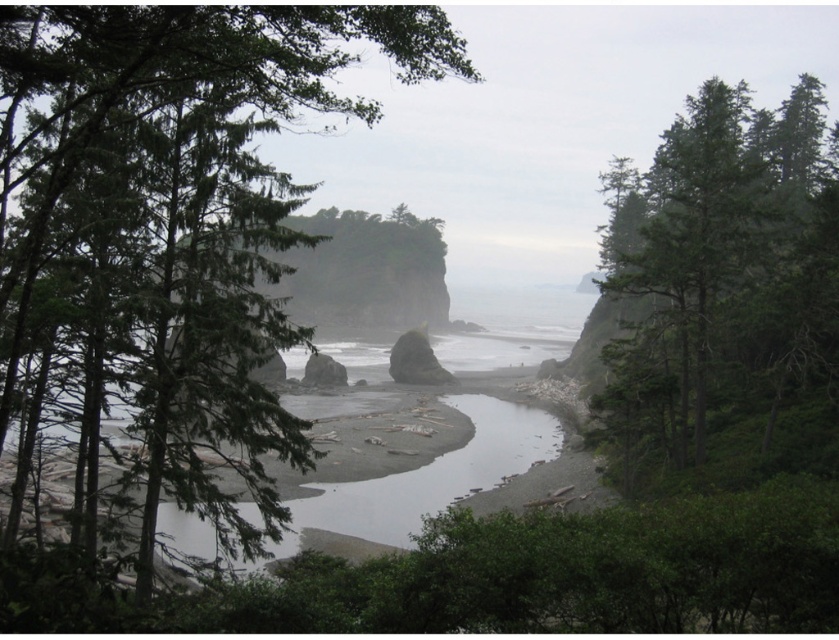
Is green leafy tree at center to the right of green textured tree at upper right from the viewer's perspective?

Incorrect, green leafy tree at center is not on the right side of green textured tree at upper right.

Consider the image. Who is positioned more to the left, green leafy tree at center or green textured tree at upper right?

From the viewer's perspective, green leafy tree at center appears more on the left side.

Image resolution: width=839 pixels, height=640 pixels. What do you see at coordinates (167, 225) in the screenshot?
I see `green leafy tree at center` at bounding box center [167, 225].

Find the location of a particular element. The width and height of the screenshot is (839, 640). green leafy tree at center is located at coordinates (167, 225).